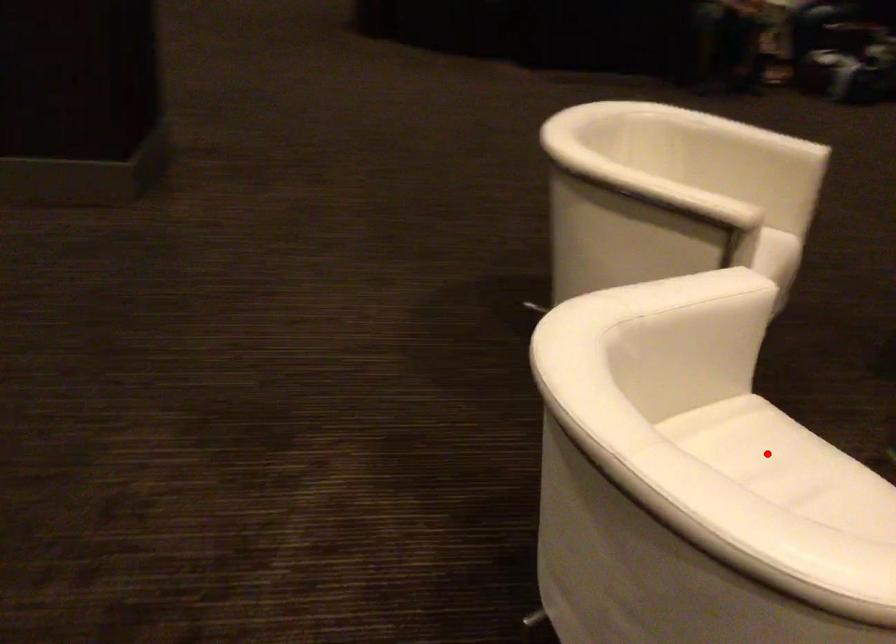
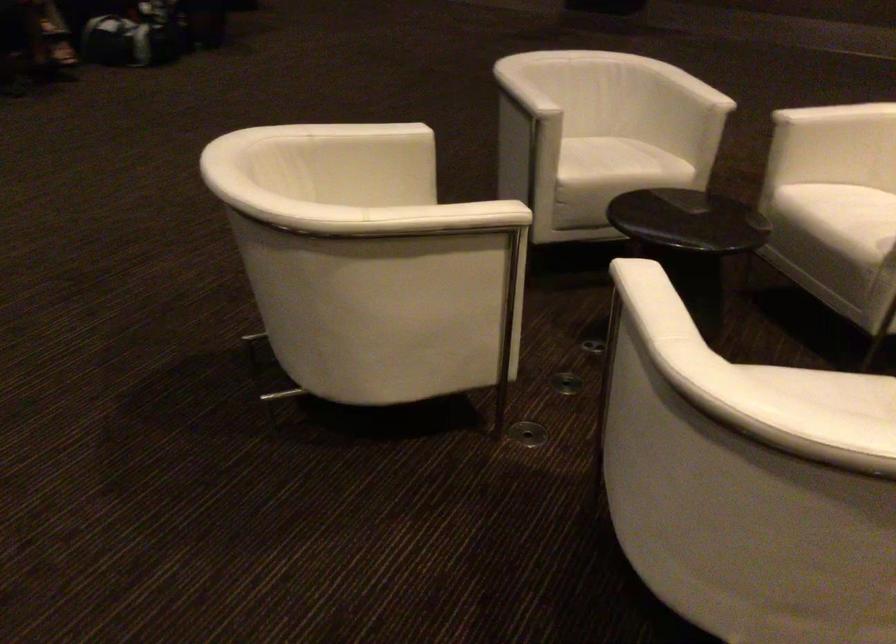
Question: I am providing you with two images of the same scene from different viewpoints. A red point is marked on the first image. At the location where the point appears in image 1, is it still visible in image 2?

Choices:
 (A) Yes
 (B) No

Answer: (B)